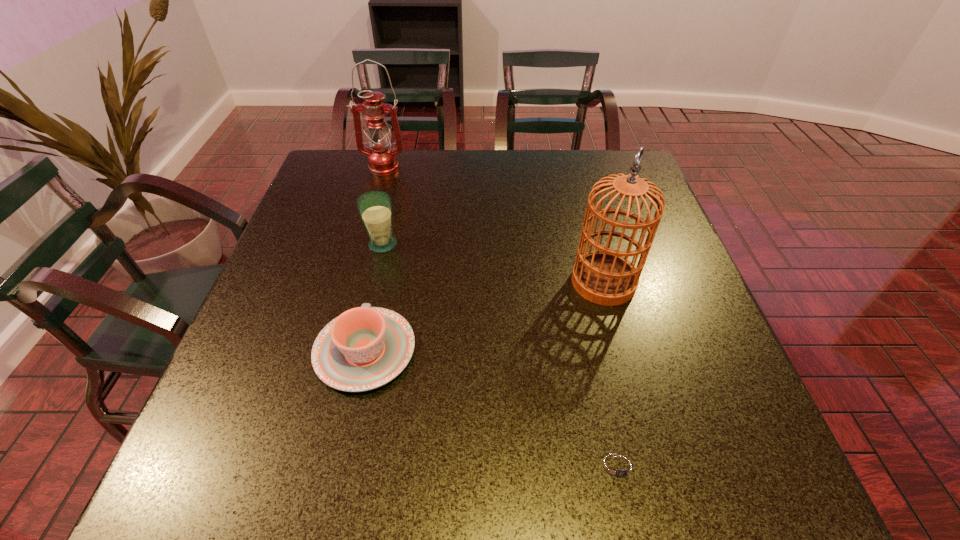
Locate an element on the screen. free space between the fourth nearest object and the fourth tallest object is located at coordinates (374, 298).

Find the location of `vacant area between the second shortest object and the shortest object`. vacant area between the second shortest object and the shortest object is located at coordinates (492, 409).

You are a GUI agent. You are given a task and a screenshot of the screen. Output one action in this format:
    pyautogui.click(x=<x>, y=<y>)
    Task: Click on the free area in between the chinaware and the third tallest object
    This screenshot has width=960, height=540.
    Given the screenshot: What is the action you would take?
    pyautogui.click(x=374, y=298)

Locate an element on the screen. unoccupied position between the birdcage and the oil lamp is located at coordinates (493, 225).

Identify the location of empty location between the glass and the shortest object. (501, 355).

Locate which object is the second closest to the second farthest object. Please provide its 2D coordinates. Your answer should be formatted as a tuple, i.e. [(x, y)], where the tuple contains the x and y coordinates of a point satisfying the conditions above.

[(382, 159)]

Select which object is the second closest to the farthest object. Please provide its 2D coordinates. Your answer should be formatted as a tuple, i.e. [(x, y)], where the tuple contains the x and y coordinates of a point satisfying the conditions above.

[(366, 347)]

Locate an element on the screen. This screenshot has height=540, width=960. free space in the image that satisfies the following two spatial constraints: 1. on the front side of the birdcage; 2. on the right side of the glass is located at coordinates (374, 282).